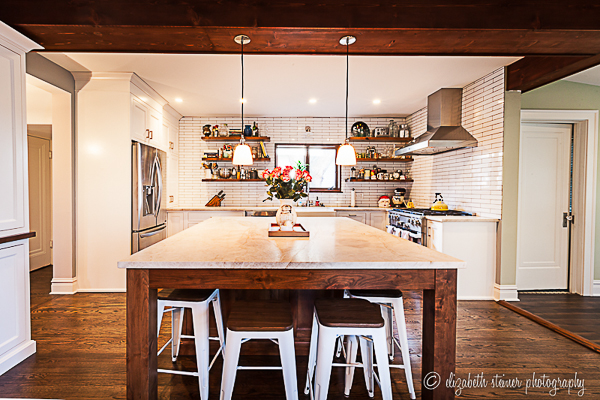
At what (x,y) coordinates should I click in order to perform the action: click on stool seat. Please return your answer as a coordinate pair (x, y). The image size is (600, 400). Looking at the image, I should click on (184, 292), (257, 315), (346, 316), (384, 292).